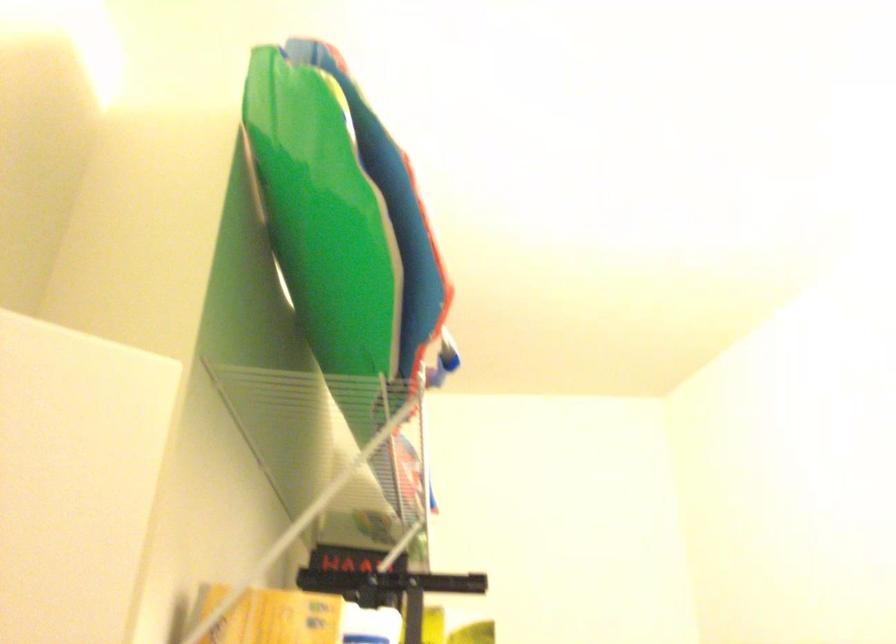
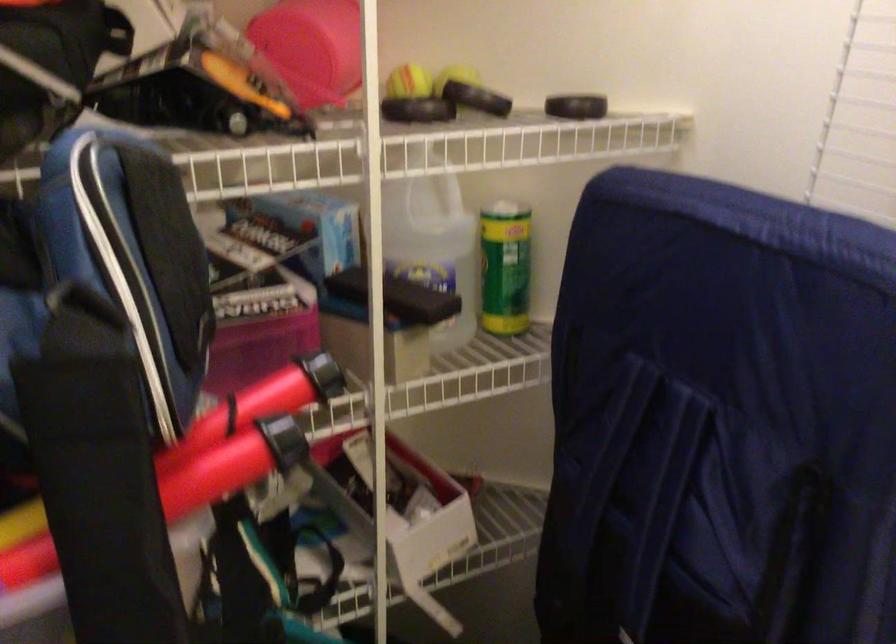
How did the camera likely rotate?

The rotation direction of the camera is left-down.